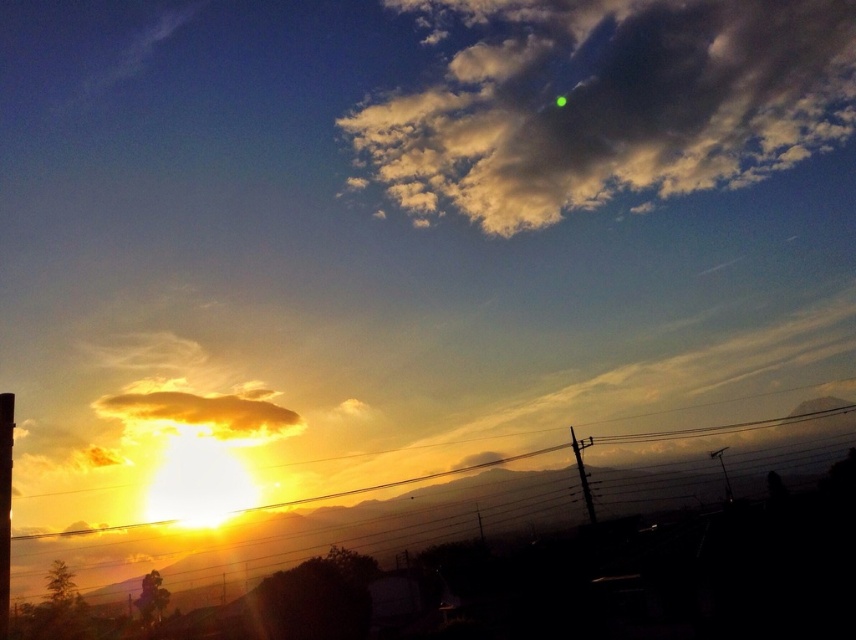
Does cloudy at upper center appear under metallic wire at lower left?

Incorrect, cloudy at upper center is not positioned below metallic wire at lower left.

I want to click on cloudy at upper center, so (608, 102).

Can you confirm if metallic wire at lower left is positioned to the right of golden yellow fluffy cloud at lower left?

Yes, metallic wire at lower left is to the right of golden yellow fluffy cloud at lower left.

Who is positioned more to the left, metallic wire at lower left or golden yellow fluffy cloud at lower left?

Positioned to the left is golden yellow fluffy cloud at lower left.

Does point (377, 536) come farther from viewer compared to point (155, 406)?

No, (377, 536) is closer to viewer.

What are the coordinates of `metallic wire at lower left` in the screenshot? It's located at (372, 524).

Can you confirm if cloudy at upper center is shorter than golden yellow fluffy cloud at lower left?

No.

Is cloudy at upper center below golden yellow fluffy cloud at lower left?

Incorrect, cloudy at upper center is not positioned below golden yellow fluffy cloud at lower left.

The height and width of the screenshot is (640, 856). What do you see at coordinates (608, 102) in the screenshot? I see `cloudy at upper center` at bounding box center [608, 102].

This screenshot has height=640, width=856. In order to click on cloudy at upper center in this screenshot , I will do `click(608, 102)`.